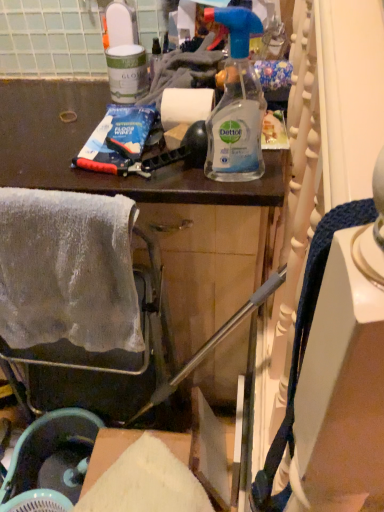
Locate an element on the screen. This screenshot has height=512, width=384. vacant space situated above matte black cabinet at upper center (from a real-world perspective) is located at coordinates (66, 122).